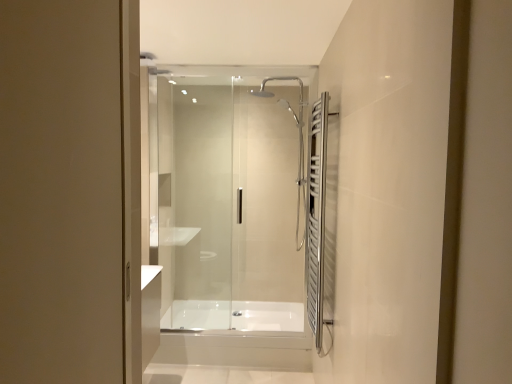
Question: Does white glossy bathtub at center have a larger size compared to transparent glass shower door at center?

Choices:
 (A) yes
 (B) no

Answer: (B)

Question: Is transparent glass shower door at center located within white glossy bathtub at center?

Choices:
 (A) yes
 (B) no

Answer: (B)

Question: Is white glossy bathtub at center at the left side of transparent glass shower door at center?

Choices:
 (A) yes
 (B) no

Answer: (B)

Question: Is the depth of white glossy bathtub at center less than that of transparent glass shower door at center?

Choices:
 (A) no
 (B) yes

Answer: (A)

Question: Can you confirm if white glossy bathtub at center is taller than transparent glass shower door at center?

Choices:
 (A) yes
 (B) no

Answer: (B)

Question: Is satin nickel towel rack at right taller or shorter than white glossy bathtub at center?

Choices:
 (A) short
 (B) tall

Answer: (B)

Question: Is satin nickel towel rack at right in front of or behind white glossy bathtub at center in the image?

Choices:
 (A) behind
 (B) front

Answer: (B)

Question: Do you think satin nickel towel rack at right is within white glossy bathtub at center, or outside of it?

Choices:
 (A) inside
 (B) outside

Answer: (B)

Question: Would you say satin nickel towel rack at right is to the left or to the right of white glossy bathtub at center in the picture?

Choices:
 (A) left
 (B) right

Answer: (B)

Question: From a real-world perspective, is white glossy bathtub at center physically located above or below satin nickel towel rack at right?

Choices:
 (A) below
 (B) above

Answer: (A)

Question: Is white glossy bathtub at center spatially inside satin nickel towel rack at right, or outside of it?

Choices:
 (A) inside
 (B) outside

Answer: (B)

Question: In terms of size, does white glossy bathtub at center appear bigger or smaller than satin nickel towel rack at right?

Choices:
 (A) small
 (B) big

Answer: (B)

Question: Would you say white glossy bathtub at center is to the left or to the right of satin nickel towel rack at right in the picture?

Choices:
 (A) right
 (B) left

Answer: (B)

Question: From their relative heights in the image, would you say transparent glass shower door at center is taller or shorter than white glossy bathtub at center?

Choices:
 (A) tall
 (B) short

Answer: (A)

Question: In terms of width, does transparent glass shower door at center look wider or thinner when compared to white glossy bathtub at center?

Choices:
 (A) wide
 (B) thin

Answer: (B)